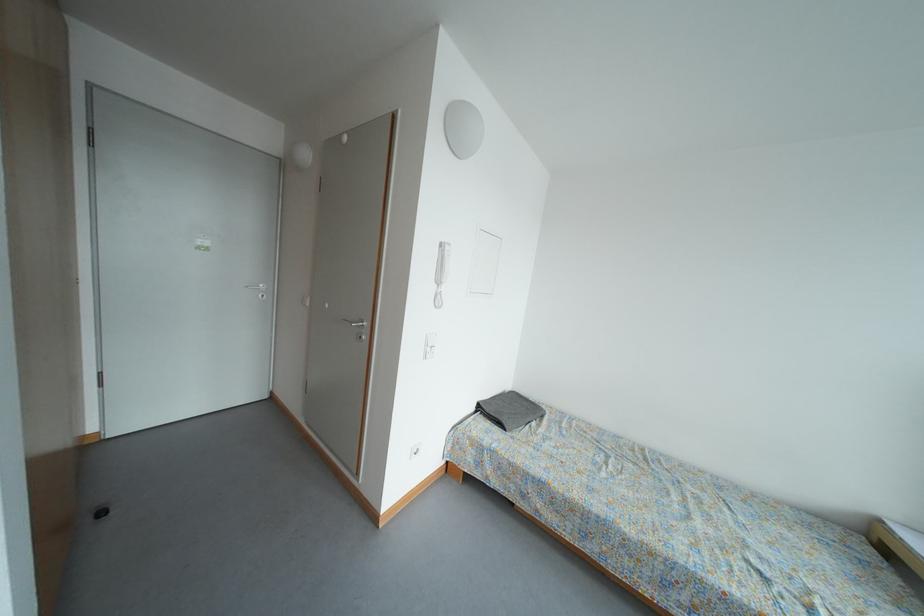
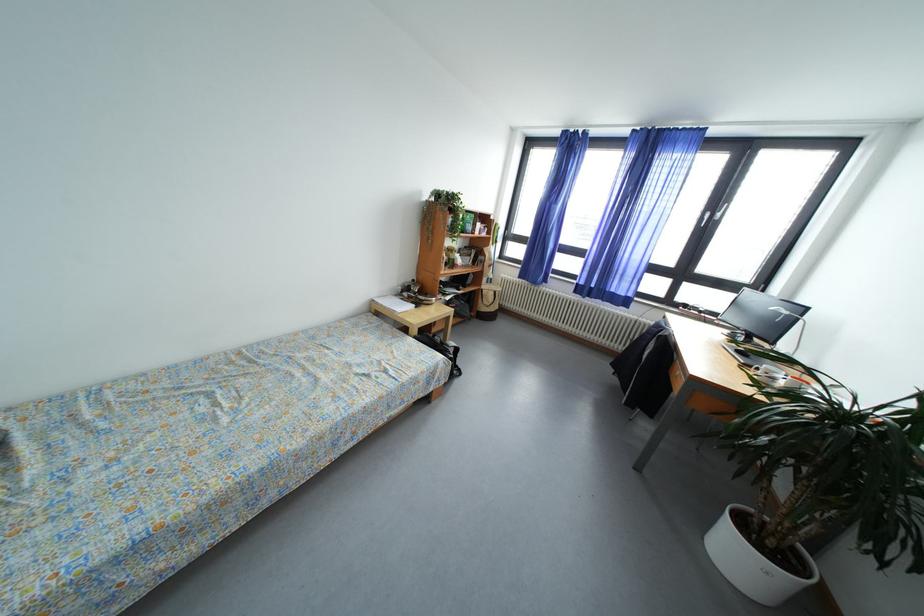
First-person continuous shooting, in which direction is the camera rotating?

The camera's rotation is toward right-down.